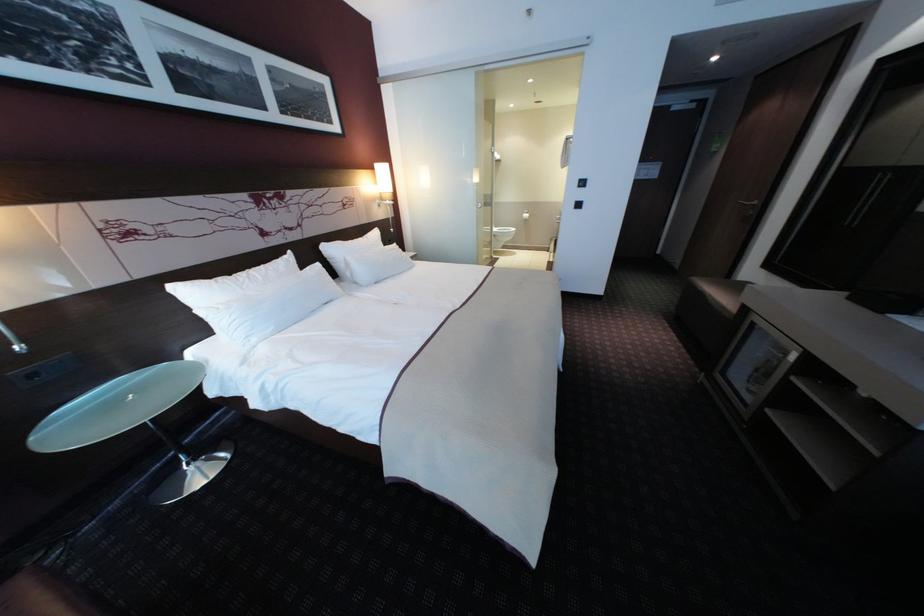
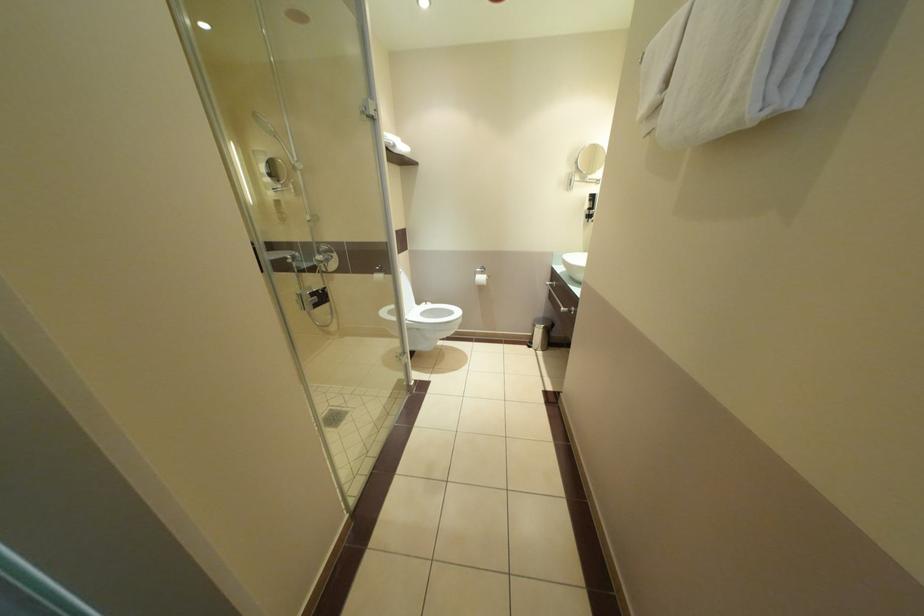
Question: In a continuous first-person perspective shot, in which direction is the camera moving?

Choices:
 (A) Left
 (B) Right
 (C) Forward
 (D) Backward

Answer: (C)